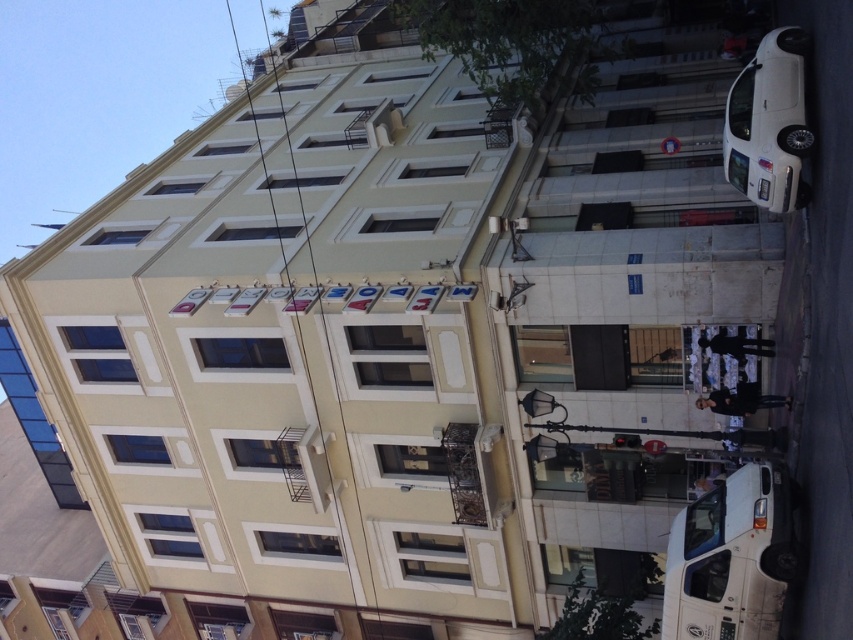
You are a delivery driver needing to park your vehicle in a narrow alley next to the building. You have two options to choose from, the white matte van at lower right and the white glossy car at right. Which vehicle would require more space to park?

The white matte van at lower right requires more space to park because its width surpasses that of the white glossy car at right.

You are a pedestrian standing in front of the building with the signboard OLOMAY. You see a white matte van at lower right and a white glossy car at right. Which vehicle is closer to you?

The white matte van at lower right is closer to you because it is in front of the white glossy car at right.

You are standing in front of the multi story building with a beige facade. You want to know how far you are from the point marked at coordinates point (787, 584). Can you determine the distance?

The distance between you and the point (787, 584) is 19.10 meters.